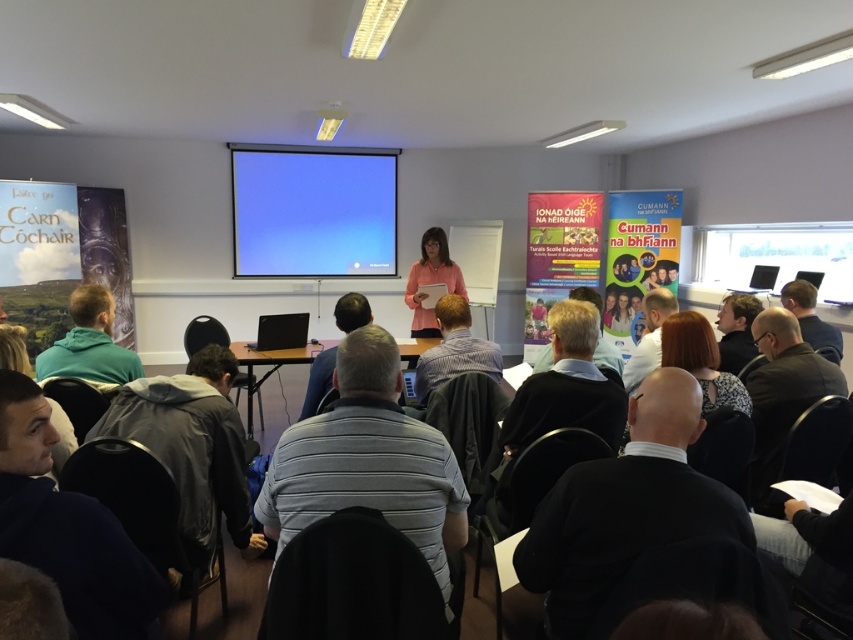
Question: Where is dark brown hair at center located in relation to dark gray shirt at center in the image?

Choices:
 (A) right
 (B) left

Answer: (B)

Question: Is the position of blue matte projection screen at upper center more distant than that of dark gray shirt at center?

Choices:
 (A) no
 (B) yes

Answer: (B)

Question: Does black fabric jacket at lower right have a smaller size compared to teal hoodie at lower left?

Choices:
 (A) yes
 (B) no

Answer: (B)

Question: Which object appears closest to the camera in this image?

Choices:
 (A) dark gray shirt at center
 (B) blue matte projection screen at upper center
 (C) matte black jacket at upper right
 (D) dark brown hair at center

Answer: (D)

Question: Estimate the real-world distances between objects in this image. Which object is farther from the dark brown hair at center?

Choices:
 (A) dark gray hoodie at lower left
 (B) teal hoodie at lower left
 (C) pink fabric at center

Answer: (C)

Question: Among these points, which one is nearest to the camera?

Choices:
 (A) (814, 312)
 (B) (447, 312)
 (C) (25, 454)
 (D) (693, 346)

Answer: (C)